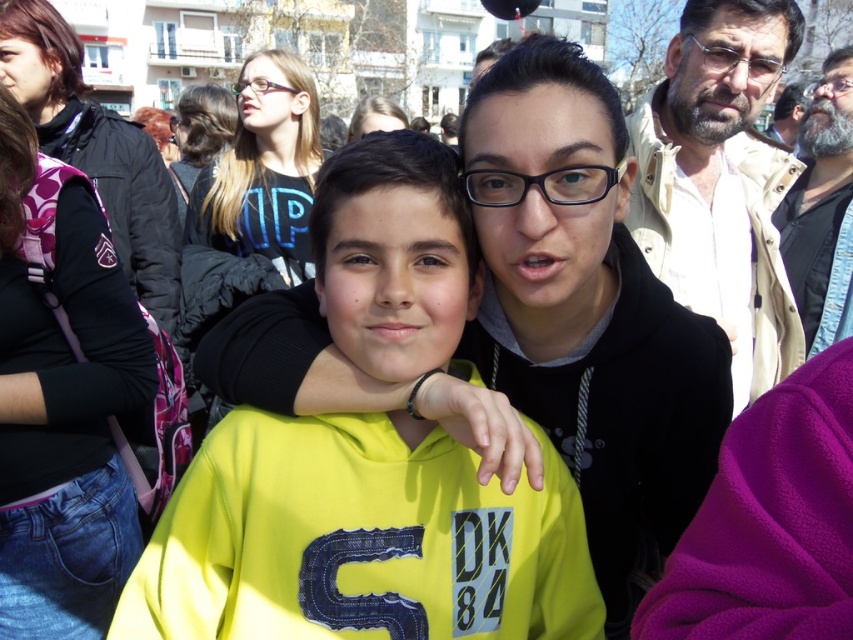
You are a photographer trying to capture a group photo of the yellow matte hoodie at center and the bearded man at right. Based on their current positions, which direction should you move to ensure both are framed equally in the photo?

Since the yellow matte hoodie at center is positioned on the left side of the bearded man at right, you should move to the right side of the bearded man at right to frame both subjects equally in the photo.

You are a fashion designer observing this scene and want to create a display using the denim jacket at left and the beige fabric jacket at upper right. Which jacket should you place higher up on the rack to match their sizes?

The denim jacket at left should be placed higher up on the rack because it has a greater height compared to the beige fabric jacket at upper right.

You are a photographer trying to capture a photo of the two hoodies in the scene. You need to ensure that both the yellow matte hoodie at center and the matte black hoodie at center are fully visible in the frame. Based on their sizes, which hoodie might require you to adjust your camera angle to avoid cropping parts of it?

The yellow matte hoodie at center might be wider than the matte black hoodie at center, so it might require adjusting the camera angle to ensure it is fully visible in the frame.